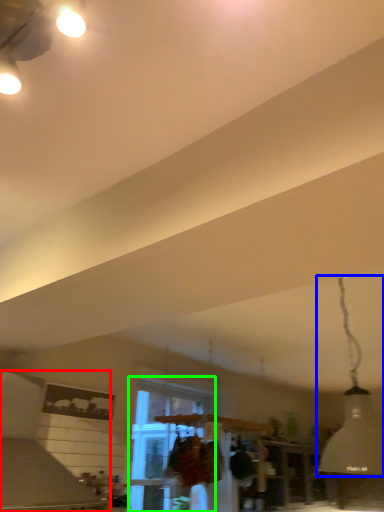
Question: Based on their relative distances, which object is farther from vent (highlighted by a red box)? Choose from lamp (highlighted by a blue box) and window (highlighted by a green box).

Choices:
 (A) lamp
 (B) window

Answer: (A)